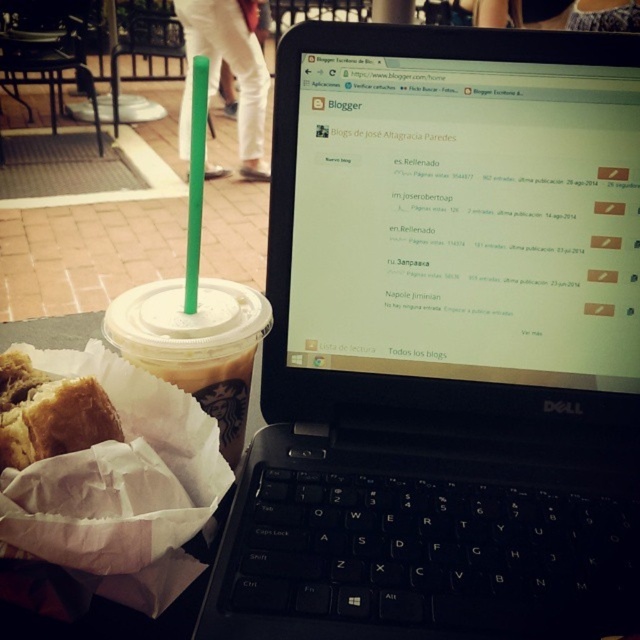
Question: Which point appears farthest from the camera in this image?

Choices:
 (A) (177, 308)
 (B) (552, 333)
 (C) (17, 362)

Answer: (B)

Question: Which of the following is the farthest from the observer?

Choices:
 (A) (436, 420)
 (B) (58, 444)
 (C) (208, 317)

Answer: (A)

Question: Where is translucent plastic cup at left located in relation to golden brown bread at lower left in the image?

Choices:
 (A) left
 (B) right

Answer: (B)

Question: Which object appears farthest from the camera in this image?

Choices:
 (A) black plastic laptop at center
 (B) golden brown bread at lower left
 (C) translucent plastic cup at left

Answer: (C)

Question: Is black plastic laptop at center positioned behind translucent plastic cup at left?

Choices:
 (A) no
 (B) yes

Answer: (A)

Question: In this image, where is black plastic laptop at center located relative to translucent plastic cup at left?

Choices:
 (A) above
 (B) below

Answer: (A)